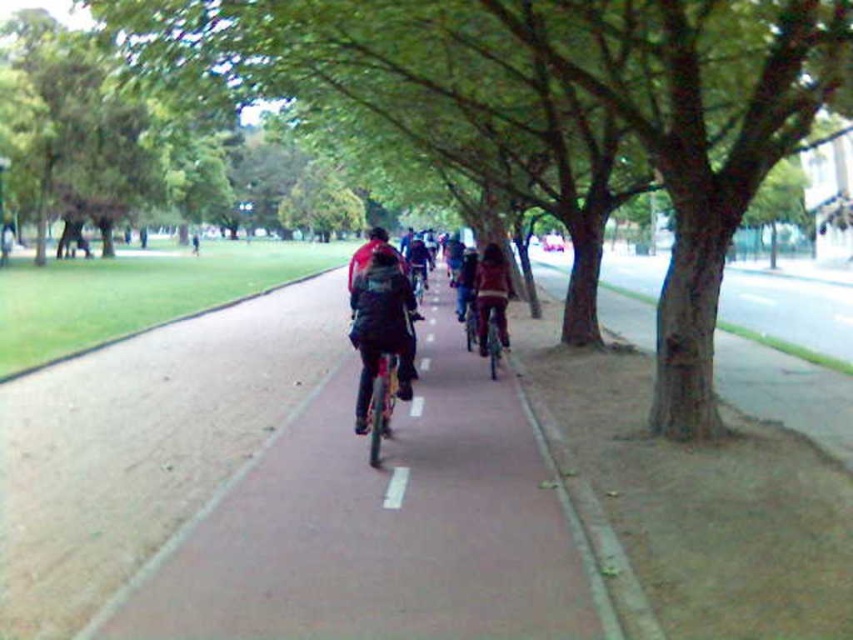
Is dark blue jacket at center behind metallic silver bicycle at center?

No, it is in front of metallic silver bicycle at center.

In order to click on dark blue jacket at center in this screenshot , I will do `click(381, 324)`.

Between point (387, 259) and point (486, 337), which one is positioned in front?

Point (387, 259) is in front.

This screenshot has height=640, width=853. I want to click on dark blue jacket at center, so click(381, 324).

Is metallic silver bicycle at center shorter than white matte line at center?

No.

Who is positioned more to the right, metallic silver bicycle at center or white matte line at center?

metallic silver bicycle at center

The height and width of the screenshot is (640, 853). I want to click on metallic silver bicycle at center, so click(491, 333).

From the picture: Is green leafy tree at center to the right of dark blue jacket at center from the viewer's perspective?

Correct, you'll find green leafy tree at center to the right of dark blue jacket at center.

This screenshot has height=640, width=853. What do you see at coordinates (672, 124) in the screenshot? I see `green leafy tree at center` at bounding box center [672, 124].

Which is in front, point (230, 42) or point (375, 348)?

Point (375, 348) is more forward.

Identify the location of green leafy tree at center. This screenshot has height=640, width=853. (672, 124).